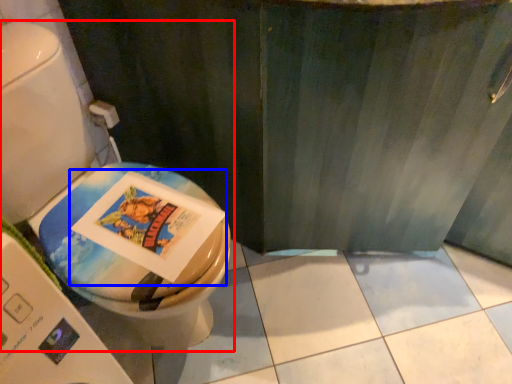
Question: Which of the following is the farthest to the observer, toilet (highlighted by a red box) or comic book (highlighted by a blue box)?

Choices:
 (A) toilet
 (B) comic book

Answer: (B)